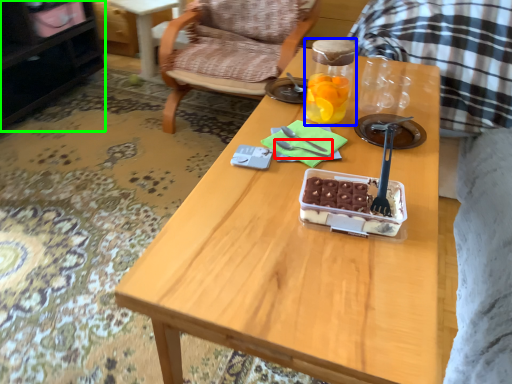
Question: Which is nearer to the fork (highlighted by a red box)? bottle (highlighted by a blue box) or cabinetry (highlighted by a green box).

Choices:
 (A) bottle
 (B) cabinetry

Answer: (A)